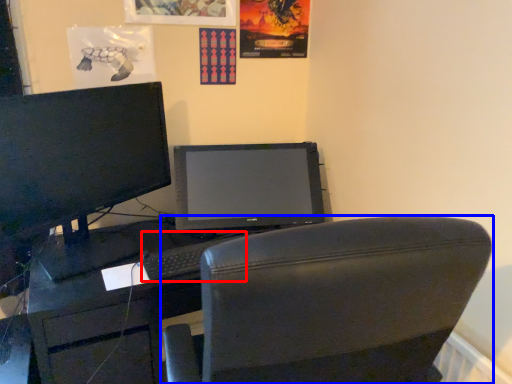
Question: Which object appears farthest to the camera in this image, keyboard (highlighted by a red box) or chair (highlighted by a blue box)?

Choices:
 (A) keyboard
 (B) chair

Answer: (A)